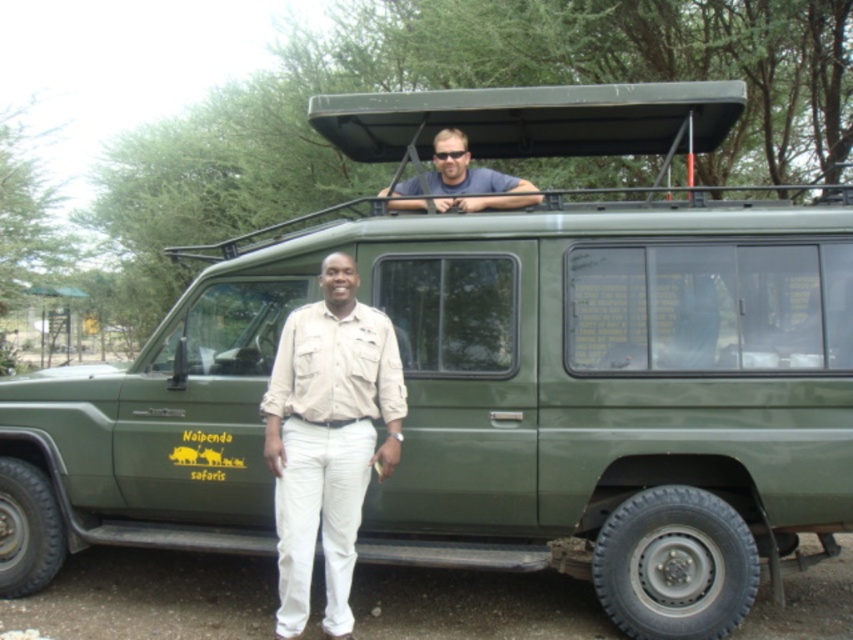
Can you confirm if khaki fabric shirt at center is positioned to the left of matte blue shirt at upper center?

Yes, khaki fabric shirt at center is to the left of matte blue shirt at upper center.

Can you confirm if khaki fabric shirt at center is wider than matte blue shirt at upper center?

In fact, khaki fabric shirt at center might be narrower than matte blue shirt at upper center.

Identify the location of khaki fabric shirt at center. (328, 438).